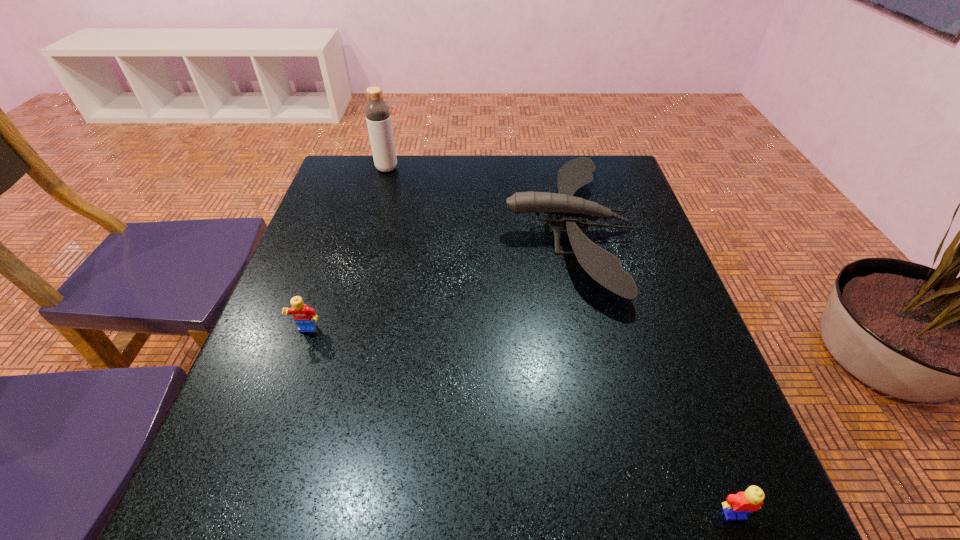
The image size is (960, 540). In order to click on bottle in this screenshot , I will do `click(377, 112)`.

Where is `the tallest object`? The height and width of the screenshot is (540, 960). the tallest object is located at coordinates (377, 112).

Find the location of `the second tallest object`. the second tallest object is located at coordinates (604, 267).

At what (x,y) coordinates should I click in order to perform the action: click on the third farthest object. Please return your answer as a coordinate pair (x, y). Looking at the image, I should click on (305, 317).

Image resolution: width=960 pixels, height=540 pixels. What are the coordinates of `the leftmost object` in the screenshot? It's located at (305, 317).

Identify the location of the right Lego. The width and height of the screenshot is (960, 540). (751, 500).

The height and width of the screenshot is (540, 960). I want to click on the nearer Lego, so click(x=751, y=500).

The height and width of the screenshot is (540, 960). What are the coordinates of `vacant space located 0.190m on the front of the tallest object` in the screenshot? It's located at (374, 213).

Where is `vacant space situated 0.350m at the head of the drone`? The image size is (960, 540). vacant space situated 0.350m at the head of the drone is located at coordinates (367, 230).

This screenshot has height=540, width=960. Identify the location of vacant space located at the head of the drone. (453, 230).